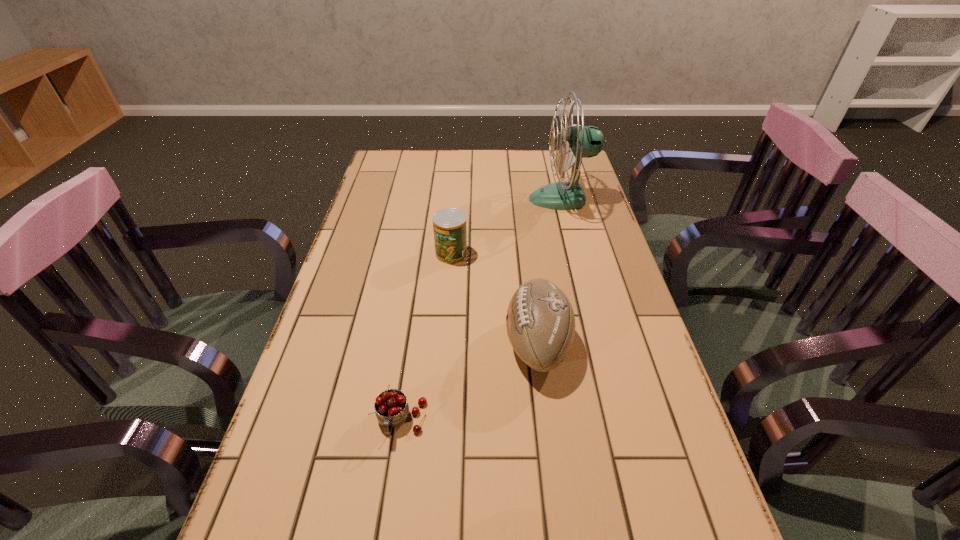
In order to click on fan in this screenshot , I will do `click(579, 142)`.

The width and height of the screenshot is (960, 540). Find the location of `the farthest object`. the farthest object is located at coordinates (579, 142).

This screenshot has width=960, height=540. Identify the location of the third shortest object. (540, 322).

I want to click on the third farthest object, so click(x=540, y=322).

Image resolution: width=960 pixels, height=540 pixels. In order to click on can in this screenshot , I will do `click(449, 225)`.

Locate an element on the screen. Image resolution: width=960 pixels, height=540 pixels. the third nearest object is located at coordinates (449, 225).

Find the location of `the nearest object`. the nearest object is located at coordinates (391, 407).

This screenshot has width=960, height=540. In order to click on the shortest object in this screenshot , I will do `click(391, 407)`.

Find the location of a particular element. The height and width of the screenshot is (540, 960). free location located in front of the farthest object, directing airflow is located at coordinates (449, 199).

Where is `free space located 0.340m in front of the farthest object, directing airflow`? The image size is (960, 540). free space located 0.340m in front of the farthest object, directing airflow is located at coordinates (429, 199).